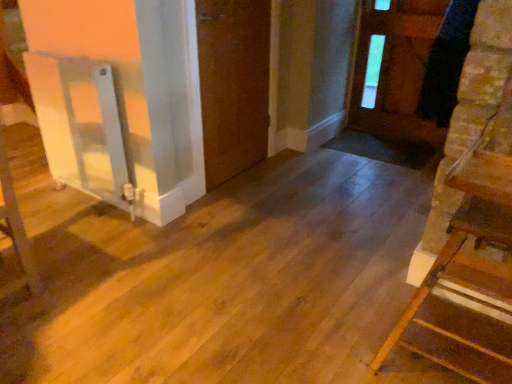
You are a GUI agent. You are given a task and a screenshot of the screen. Output one action in this format:
    pyautogui.click(x=<x>, y=<y>)
    Task: Click on the vacant area that lies in front of brown matte door at center, which is the 1th door from left to right
    
    Given the screenshot: What is the action you would take?
    pyautogui.click(x=249, y=198)